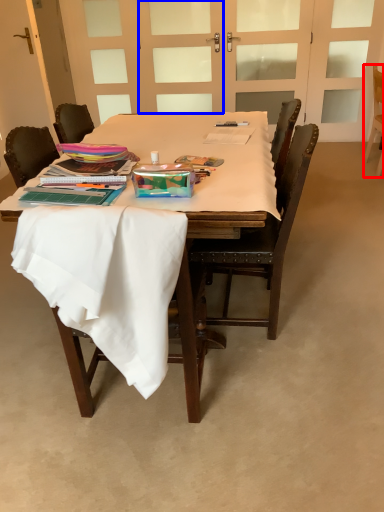
Question: Which object is further to the camera taking this photo, chair (highlighted by a red box) or screen door (highlighted by a blue box)?

Choices:
 (A) chair
 (B) screen door

Answer: (B)